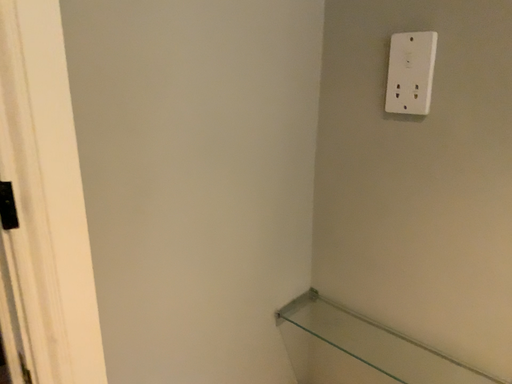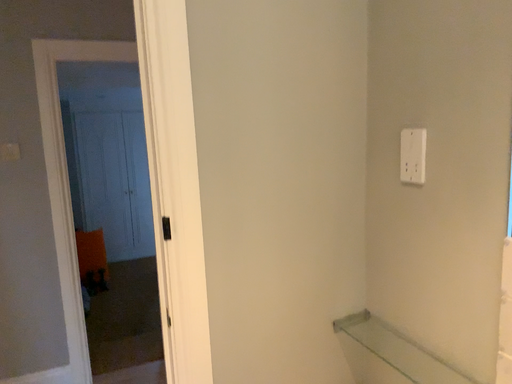
Question: How did the camera likely rotate when shooting the video?

Choices:
 (A) rotated downward
 (B) rotated upward

Answer: (B)